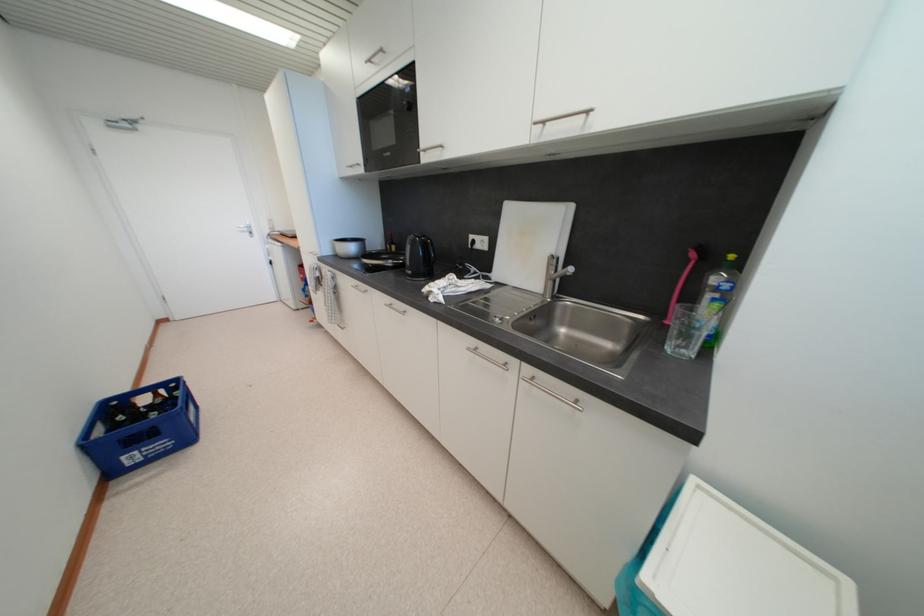
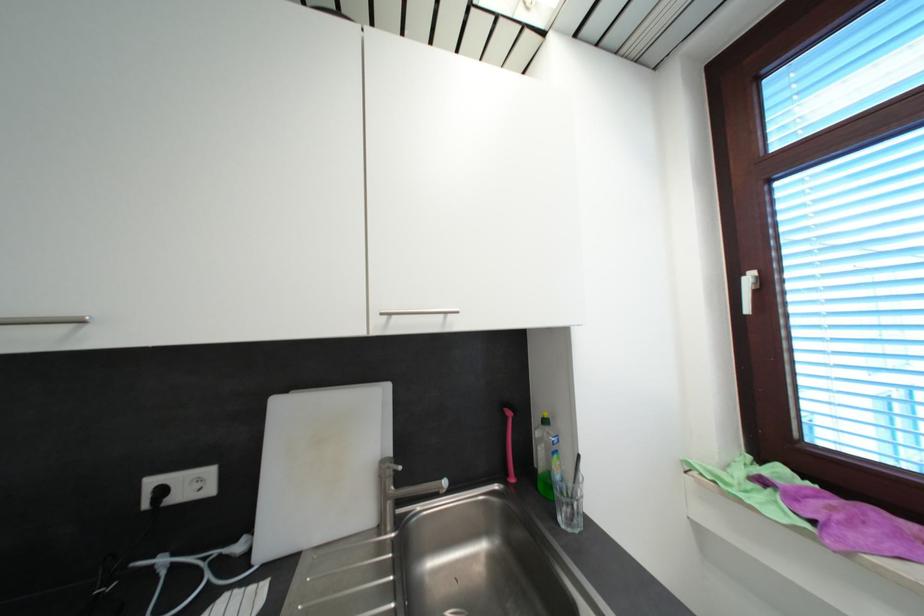
Question: How did the camera likely rotate?

Choices:
 (A) Left
 (B) Right
 (C) Up
 (D) Down

Answer: (B)